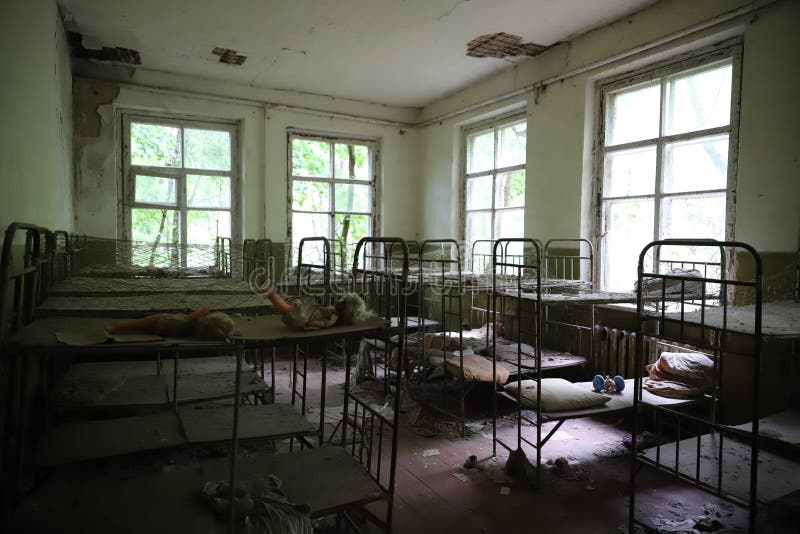
What are the coordinates of `doll` in the screenshot? It's located at (314, 307), (176, 325).